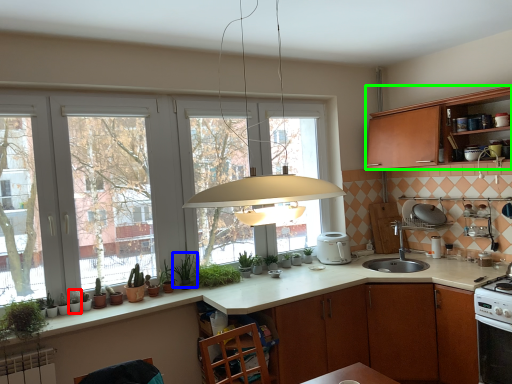
Question: Which object is the farthest from plant (highlighted by a red box)? Choose among these: plant (highlighted by a blue box) or cabinetry (highlighted by a green box).

Choices:
 (A) plant
 (B) cabinetry

Answer: (B)